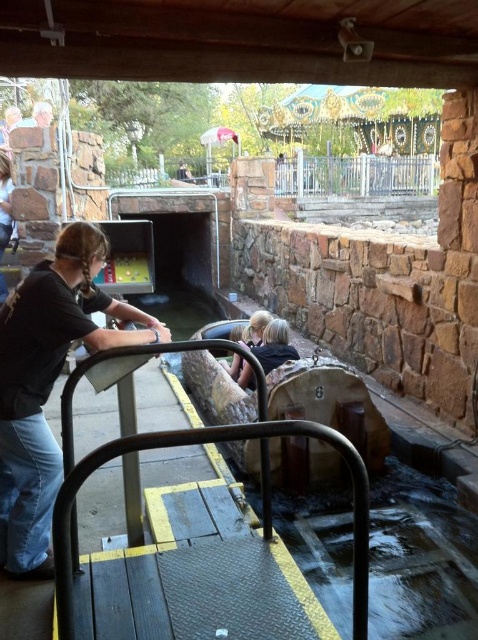
Is black matte shirt at left positioned behind matte black shirt at upper left?

No.

This screenshot has height=640, width=478. What do you see at coordinates (49, 384) in the screenshot? I see `black matte shirt at left` at bounding box center [49, 384].

Who is more forward, (17, 458) or (43, 118)?

Positioned in front is point (17, 458).

The height and width of the screenshot is (640, 478). Identify the location of black matte shirt at left. pyautogui.click(x=49, y=384).